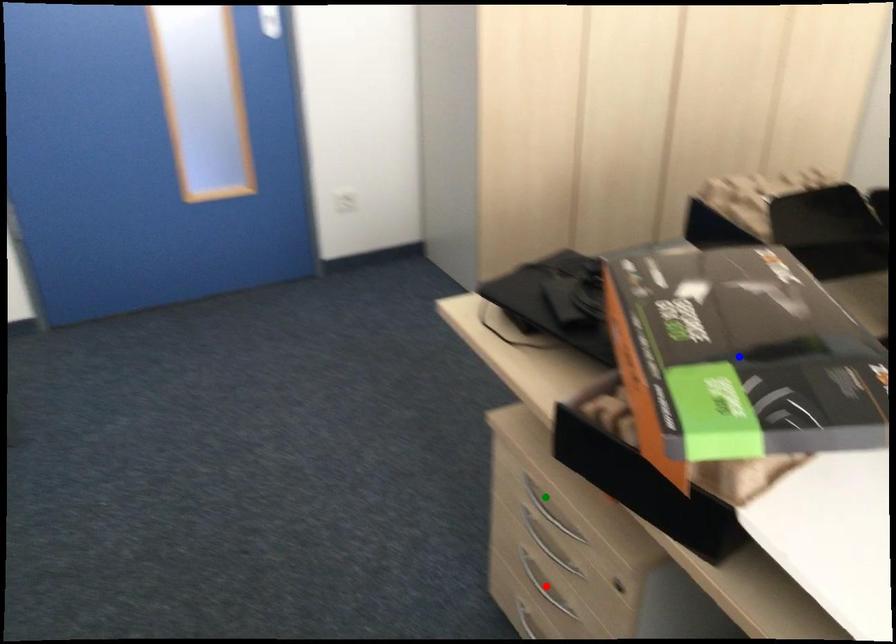
Order these from nearest to farthest:
red point
green point
blue point

blue point < green point < red point